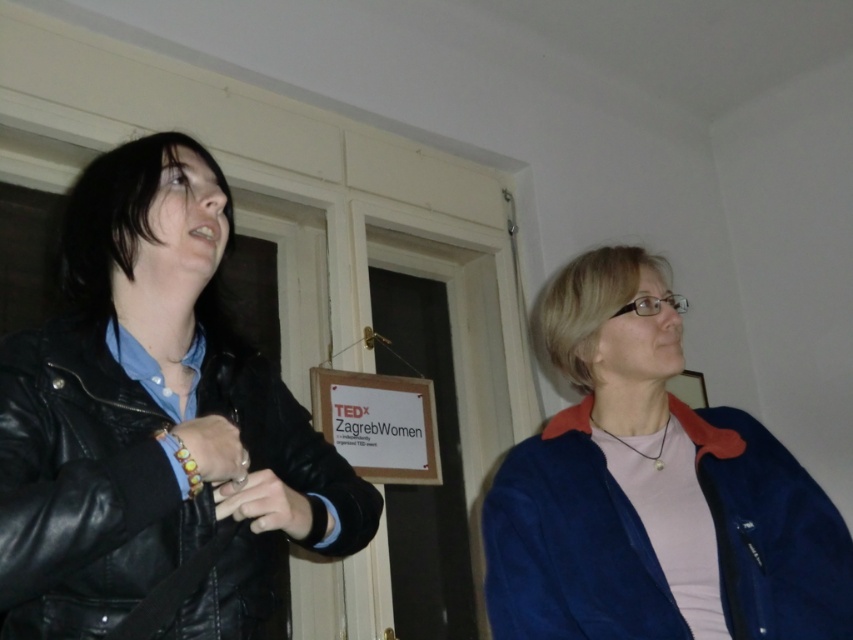
You are trying to decide which jacket to take with you. The black leather jacket at left is smaller than the blue suede jacket at right. Which jacket has a larger size?

The blue suede jacket at right is larger than the black leather jacket at left.

You are a delivery person trying to place a small package between the black leather jacket at left and the matte black ring at lower left. The package is 8 inches long. Will it fit in the space between them?

The space between the black leather jacket at left and the matte black ring at lower left is 7.33 inches. Since the package is 8 inches long, it will not fit in the space between them.